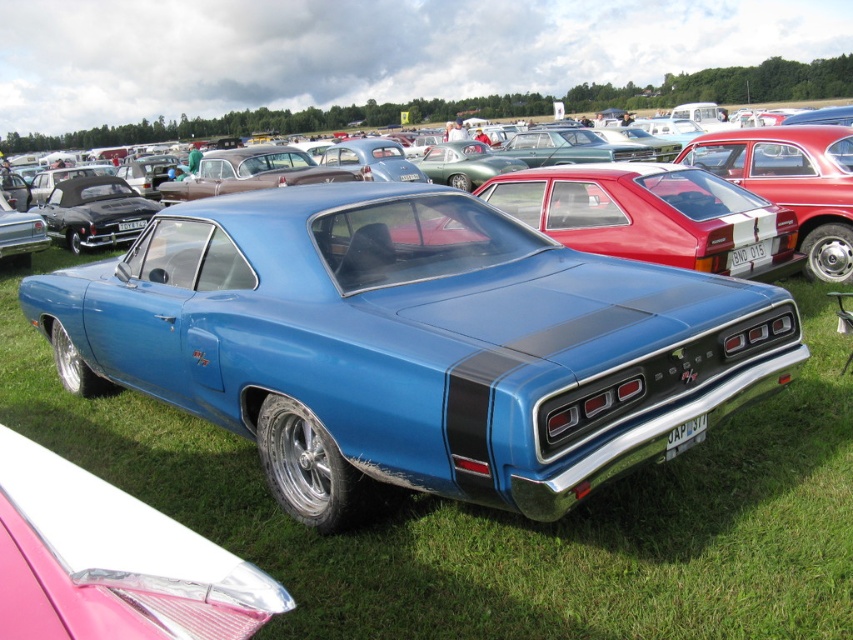
Which is in front, point (448, 374) or point (834, 259)?

Positioned in front is point (448, 374).

Who is positioned more to the left, metallic blue muscle car at center or metallic blue car at center?

metallic blue muscle car at center

Is point (517, 326) closer to camera compared to point (732, 148)?

Yes, it is in front of point (732, 148).

Where is `metallic blue muscle car at center`? metallic blue muscle car at center is located at coordinates (413, 344).